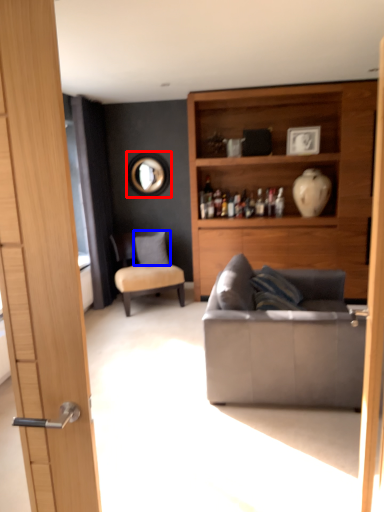
Question: Which object is further to the camera taking this photo, mirror (highlighted by a red box) or pillow (highlighted by a blue box)?

Choices:
 (A) mirror
 (B) pillow

Answer: (A)